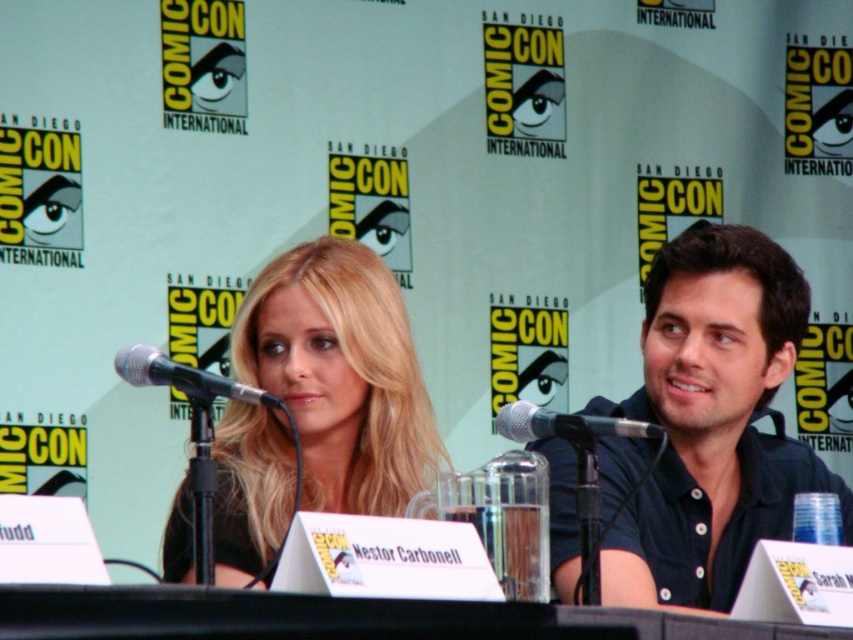
Question: In this image, where is black metallic microphone at left located relative to silver metallic microphone at center?

Choices:
 (A) left
 (B) right

Answer: (A)

Question: Is dark blue shirt at center positioned at the back of black metallic microphone at left?

Choices:
 (A) yes
 (B) no

Answer: (A)

Question: Which object is closer to the camera taking this photo?

Choices:
 (A) dark blue shirt at center
 (B) silver metallic microphone at center
 (C) blonde hair at center

Answer: (B)

Question: Can you confirm if dark blue shirt at center is positioned to the right of blonde hair at center?

Choices:
 (A) yes
 (B) no

Answer: (A)

Question: Which point is farther to the camera?

Choices:
 (A) (219, 516)
 (B) (213, 387)

Answer: (A)

Question: Which point appears farthest from the camera in this image?

Choices:
 (A) (708, 362)
 (B) (222, 477)
 (C) (235, 396)
 (D) (645, 429)

Answer: (A)